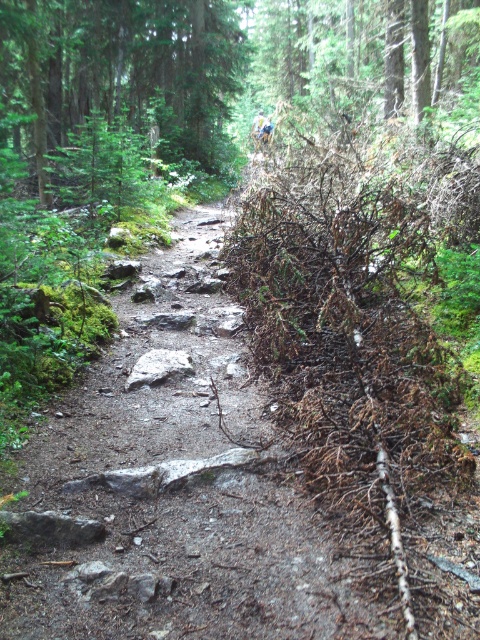
Which is below, dirt path at center or green matte tree at upper center?

dirt path at center

Is dirt path at center above green matte tree at upper center?

Actually, dirt path at center is below green matte tree at upper center.

Is point (162, 308) closer to viewer compared to point (144, 33)?

Yes, point (162, 308) is closer to viewer.

Identify the location of dirt path at center. This screenshot has height=640, width=480. (173, 484).